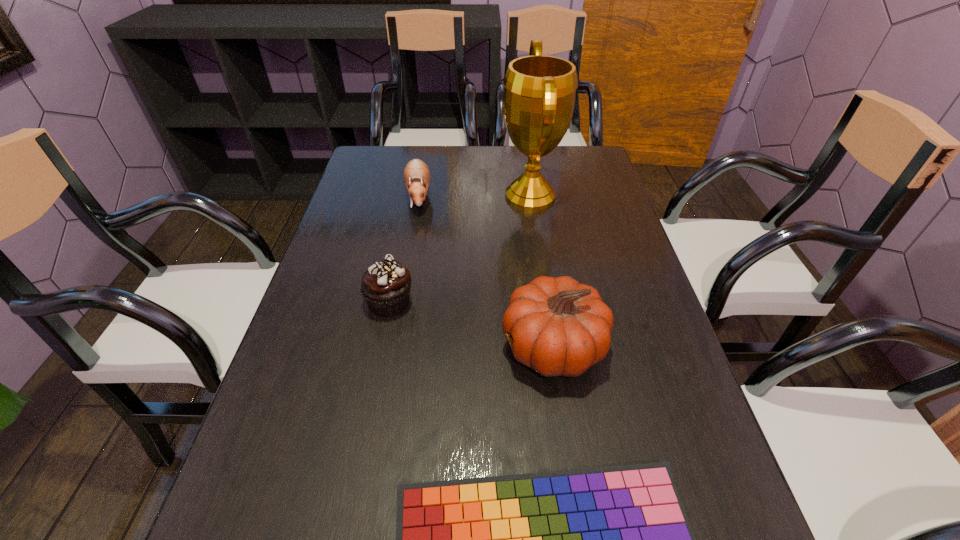
In the image, there is a desktop. Where is `free space at the right edge`? The width and height of the screenshot is (960, 540). free space at the right edge is located at coordinates (658, 394).

In the image, there is a desktop. Where is `free space at the far right corner`? The width and height of the screenshot is (960, 540). free space at the far right corner is located at coordinates (594, 165).

I want to click on free space that is in between the tallest object and the pumpkin, so click(541, 272).

Find the location of a particular element. This screenshot has width=960, height=540. free space between the second tallest object and the tallest object is located at coordinates (541, 272).

Find the location of a particular element. This screenshot has width=960, height=540. vacant point located between the cupcake and the hamster is located at coordinates pyautogui.click(x=404, y=249).

The image size is (960, 540). What are the coordinates of `vacant region between the tallest object and the pumpkin` in the screenshot? It's located at (541, 272).

Locate an element on the screen. free space that is in between the cupcake and the tallest object is located at coordinates (460, 249).

Find the location of a particular element. free space that is in between the cupcake and the second tallest object is located at coordinates (471, 325).

Where is `free spot between the hamster and the award`? Image resolution: width=960 pixels, height=540 pixels. free spot between the hamster and the award is located at coordinates (474, 196).

Find the location of a particular element. object that is the second nearest to the hamster is located at coordinates (385, 286).